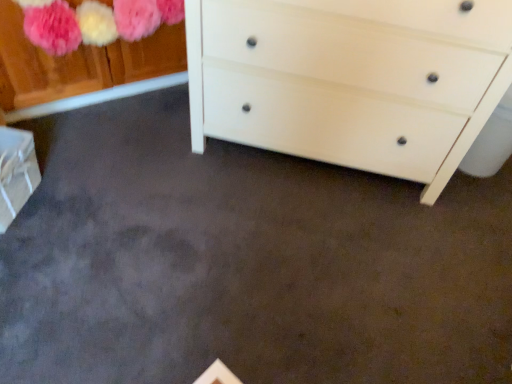
Question: Relative to white cardboard box at lower left, is white matte chest of drawers at center in front or behind?

Choices:
 (A) behind
 (B) front

Answer: (B)

Question: Looking at the image, does white matte chest of drawers at center seem bigger or smaller compared to white cardboard box at lower left?

Choices:
 (A) big
 (B) small

Answer: (A)

Question: Is white matte chest of drawers at center situated inside white cardboard box at lower left or outside?

Choices:
 (A) inside
 (B) outside

Answer: (B)

Question: From a real-world perspective, is white cardboard box at lower left positioned above or below white matte chest of drawers at center?

Choices:
 (A) above
 (B) below

Answer: (B)

Question: From the image's perspective, relative to white matte chest of drawers at center, is white cardboard box at lower left above or below?

Choices:
 (A) above
 (B) below

Answer: (B)

Question: Is point (5, 226) closer or farther from the camera than point (441, 13)?

Choices:
 (A) closer
 (B) farther

Answer: (B)

Question: Is white cardboard box at lower left to the left or to the right of white matte chest of drawers at center in the image?

Choices:
 (A) right
 (B) left

Answer: (B)